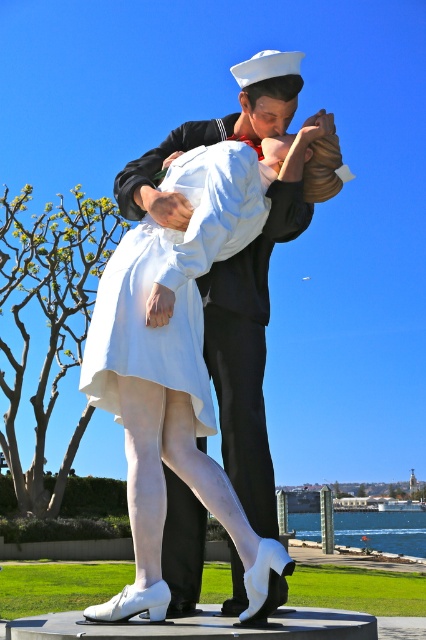
Consider the image. Who is taller, matte white dress at center or white satin dress at center?

matte white dress at center

Locate an element on the screen. matte white dress at center is located at coordinates (198, 333).